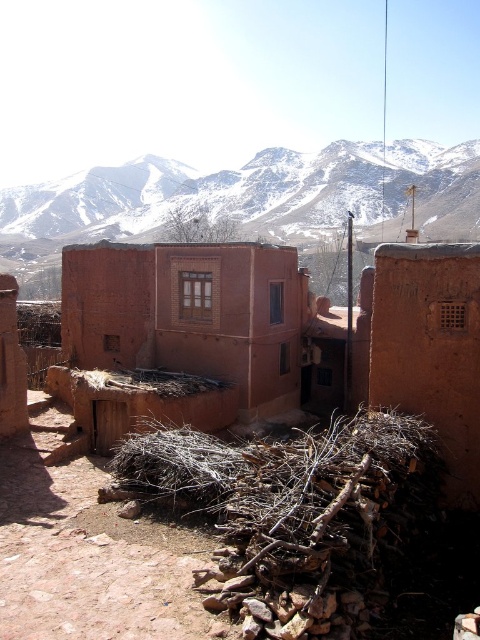
Can you confirm if brown dry wood at lower center is shorter than snowy rock at upper center?

Yes.

The width and height of the screenshot is (480, 640). What do you see at coordinates (292, 504) in the screenshot? I see `brown dry wood at lower center` at bounding box center [292, 504].

Locate an element on the screen. brown dry wood at lower center is located at coordinates (292, 504).